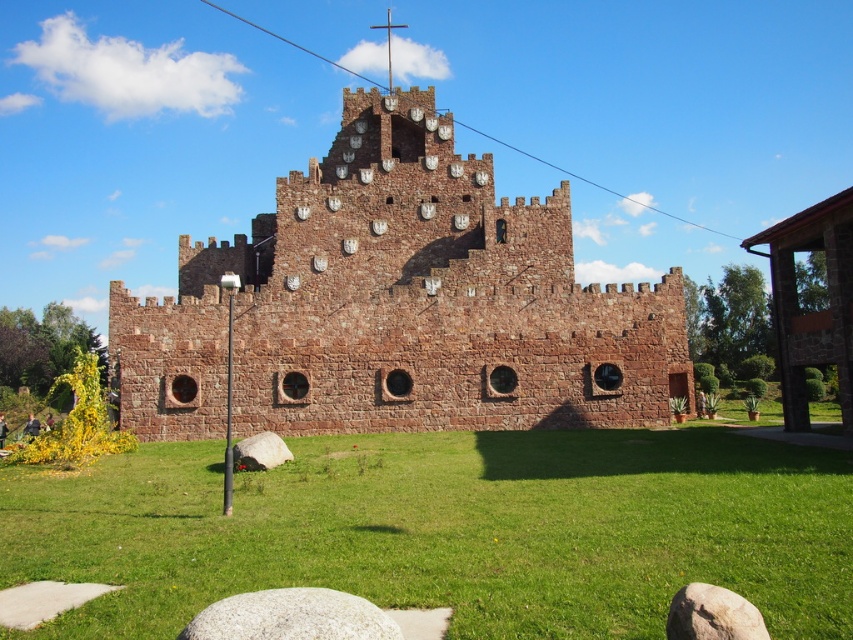
Who is positioned more to the left, brown stone castle at center or brown rough stone at lower right?

From the viewer's perspective, brown stone castle at center appears more on the left side.

The height and width of the screenshot is (640, 853). What do you see at coordinates (396, 305) in the screenshot?
I see `brown stone castle at center` at bounding box center [396, 305].

This screenshot has width=853, height=640. What are the coordinates of `brown stone castle at center` in the screenshot? It's located at [396, 305].

Can you confirm if brown stone castle at center is shorter than gray granite rock at lower center?

In fact, brown stone castle at center may be taller than gray granite rock at lower center.

Is brown stone castle at center bigger than gray granite rock at lower center?

Yes, brown stone castle at center is bigger than gray granite rock at lower center.

Does point (479, 342) lie behind point (347, 593)?

Yes, point (479, 342) is farther from viewer.

Identify the location of brown stone castle at center. (396, 305).

Does gray granite rock at lower center appear under gray smooth rock at lower center?

Yes, gray granite rock at lower center is below gray smooth rock at lower center.

Can you confirm if gray granite rock at lower center is positioned above gray smooth rock at lower center?

No, gray granite rock at lower center is not above gray smooth rock at lower center.

Find the location of `gray granite rock at lower center`. gray granite rock at lower center is located at coordinates (291, 616).